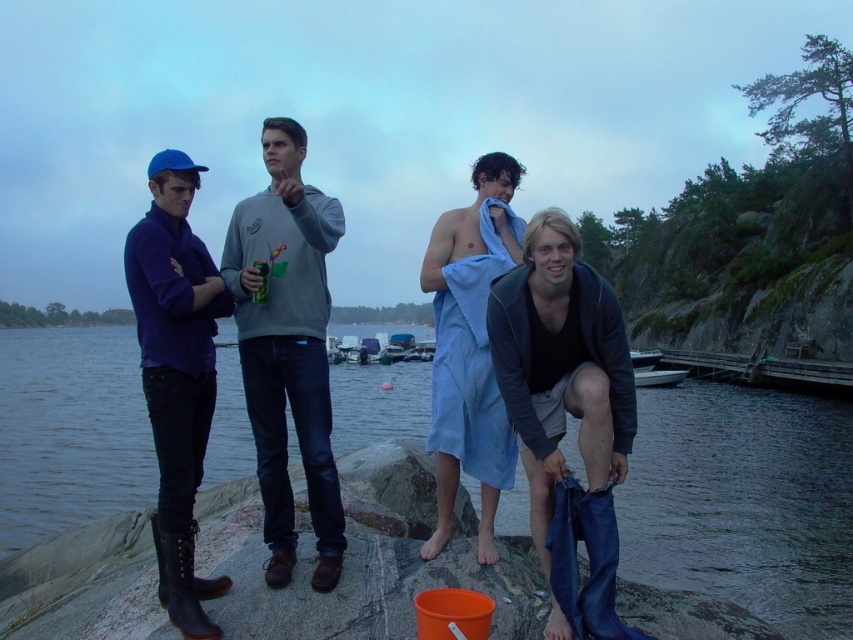
You are standing at the point with coordinates (469, 348). What object is located at this position?

The blue towel at center is located at the coordinates (469, 348).

Looking at this image, you are a photographer trying to capture a photo of the matte blue sweater at left and the blue towel at lower right. Since you want both items to be clearly visible in the frame, which object should you focus on to ensure proper depth of field?

You should focus on the matte blue sweater at left because it has a greater height compared to the blue towel at lower right, so it will require more precise focus to capture details clearly.